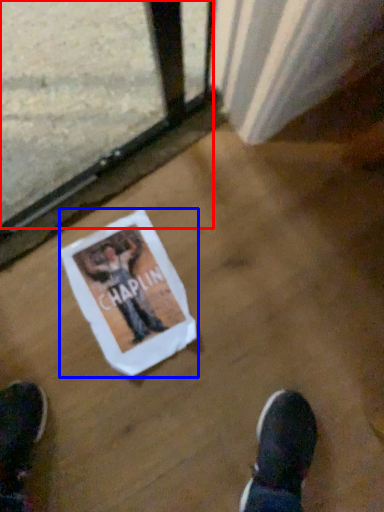
Question: Which of the following is the farthest to the observer, train window (highlighted by a red box) or flyer (highlighted by a blue box)?

Choices:
 (A) train window
 (B) flyer

Answer: (B)